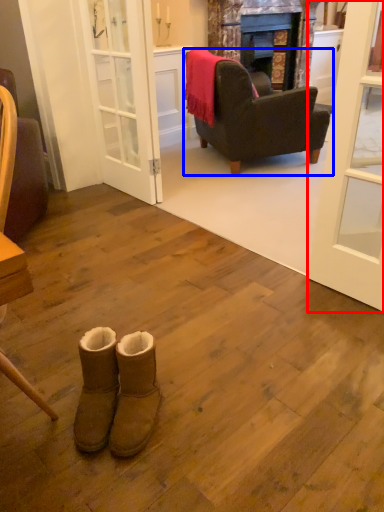
Question: Which object is closer to the camera taking this photo, door (highlighted by a red box) or chair (highlighted by a blue box)?

Choices:
 (A) door
 (B) chair

Answer: (A)